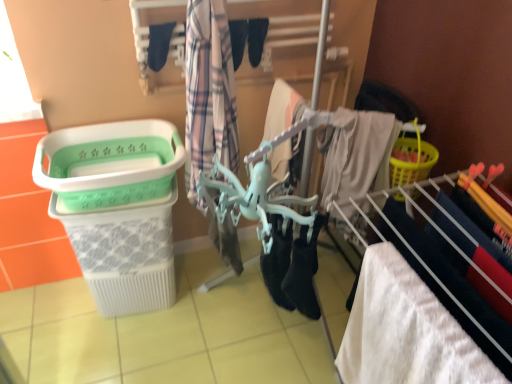
Question: From a real-world perspective, is black fabric socks at upper center, which is the 2th clothing in right-to-left order, located beneath black fabric shoe at center, placed as the 1th shoe when sorted from left to right?

Choices:
 (A) no
 (B) yes

Answer: (A)

Question: Does black fabric socks at upper center, which is the 2th clothing in right-to-left order, touch black fabric shoe at center, placed as the 1th shoe when sorted from left to right?

Choices:
 (A) yes
 (B) no

Answer: (B)

Question: Is black fabric socks at upper center, placed as the first clothing when sorted from left to right, facing away from black fabric shoe at center, the second shoe when ordered from right to left?

Choices:
 (A) no
 (B) yes

Answer: (A)

Question: Does black fabric socks at upper center, which is the 2th clothing in right-to-left order, have a greater height compared to black fabric shoe at center, placed as the 1th shoe when sorted from left to right?

Choices:
 (A) yes
 (B) no

Answer: (B)

Question: Is black fabric socks at upper center, placed as the first clothing when sorted from left to right, far from black fabric shoe at center, placed as the 1th shoe when sorted from left to right?

Choices:
 (A) yes
 (B) no

Answer: (B)

Question: From a real-world perspective, is green plastic laundry basket at left positioned above or below white fluffy towel at lower right?

Choices:
 (A) below
 (B) above

Answer: (B)

Question: From the image's perspective, is green plastic laundry basket at left located above or below white fluffy towel at lower right?

Choices:
 (A) below
 (B) above

Answer: (B)

Question: Considering their positions, is green plastic laundry basket at left located in front of or behind white fluffy towel at lower right?

Choices:
 (A) front
 (B) behind

Answer: (B)

Question: Is point (114, 130) positioned closer to the camera than point (358, 365)?

Choices:
 (A) closer
 (B) farther

Answer: (B)

Question: Considering the positions of point (238, 34) and point (214, 125), is point (238, 34) closer or farther from the camera than point (214, 125)?

Choices:
 (A) farther
 (B) closer

Answer: (A)

Question: Is black fabric shoe at center, the second shoe when ordered from right to left, in front of or behind plaid fabric at center, the first clothing when ordered from right to left, in the image?

Choices:
 (A) front
 (B) behind

Answer: (B)

Question: Is black fabric shoe at center, the second shoe when ordered from right to left, spatially inside plaid fabric at center, the first clothing when ordered from right to left, or outside of it?

Choices:
 (A) inside
 (B) outside

Answer: (B)

Question: From a real-world perspective, is black fabric shoe at center, the second shoe when ordered from right to left, above or below plaid fabric at center, positioned as the 2th clothing in left-to-right order?

Choices:
 (A) below
 (B) above

Answer: (B)

Question: Looking at the image, does green plastic laundry basket at left seem bigger or smaller compared to black fabric shoe at center, placed as the 1th shoe when sorted from left to right?

Choices:
 (A) big
 (B) small

Answer: (A)

Question: From the image's perspective, is green plastic laundry basket at left positioned above or below black fabric shoe at center, the second shoe when ordered from right to left?

Choices:
 (A) below
 (B) above

Answer: (A)